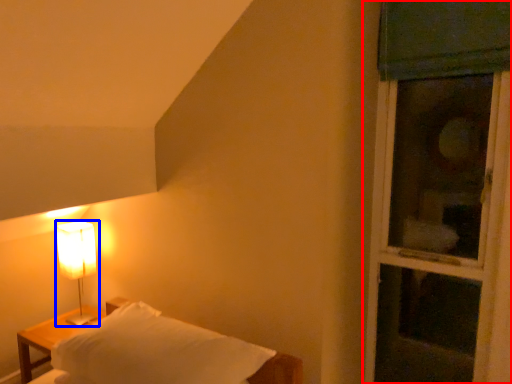
Question: Which object appears farthest to the camera in this image, window (highlighted by a red box) or lamp (highlighted by a blue box)?

Choices:
 (A) window
 (B) lamp

Answer: (B)